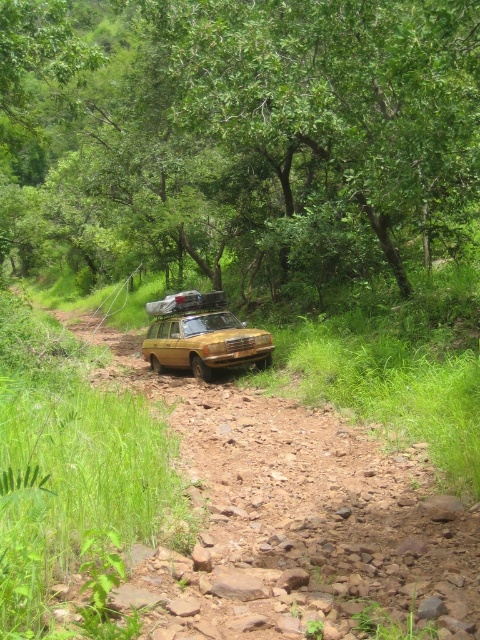
You are planning to take a photo of the matte yellow jeep at center while standing behind the green leafy tree at center. Will the tree block the entire jeep from your view?

The green leafy tree at center is larger than the matte yellow jeep at center, so it might block part of the jeep depending on the angle, but not necessarily the entire vehicle.

You are a hiker planning to drive the rusty metallic station wagon at center through the narrow rocky path. Considering the size of the green leafy tree at center, do you think the vehicle can pass without damaging the tree?

The green leafy tree at center is larger than the rusty metallic station wagon at center. Since the tree is bigger, there might be insufficient space for the vehicle to pass safely without causing damage. It is advisable to choose a different route or assess the path more carefully.